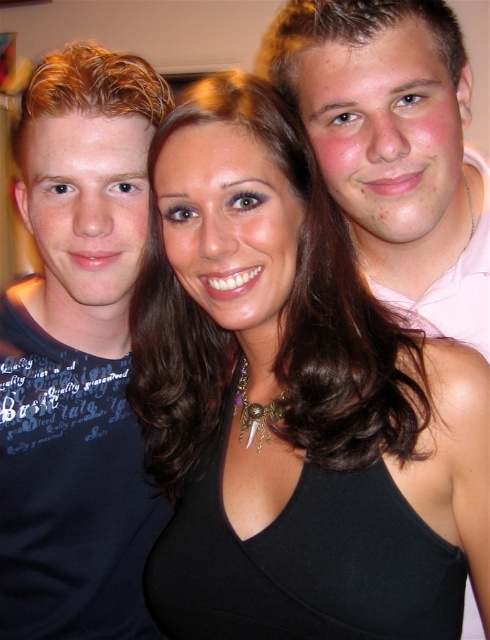
Can you confirm if matte blue shirt at left is taller than pink cotton shirt at right?

Yes, matte blue shirt at left is taller than pink cotton shirt at right.

Who is more distant from viewer, (125, 147) or (400, 212)?

The point (125, 147) is more distant.

Which is in front, point (73, 122) or point (384, 65)?

Point (384, 65) is more forward.

The width and height of the screenshot is (490, 640). I want to click on matte blue shirt at left, so click(76, 355).

Does point (278, 401) come farther from viewer compared to point (42, 83)?

No.

Does point (451, 481) come closer to viewer compared to point (49, 282)?

That is True.

Which is behind, point (234, 292) or point (88, 60)?

The point (88, 60) is more distant.

Locate an element on the screen. This screenshot has width=490, height=640. black satin dress at center is located at coordinates (273, 385).

Which is behind, point (235, 316) or point (390, 48)?

The point (390, 48) is more distant.

Who is more distant from viewer, (227, 456) or (364, 195)?

The point (227, 456) is more distant.

Find the location of a particular element. This screenshot has width=490, height=640. black satin dress at center is located at coordinates (273, 385).